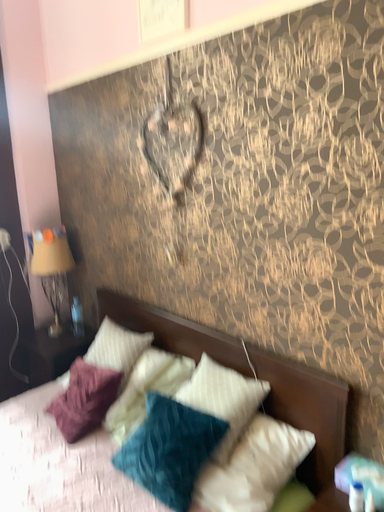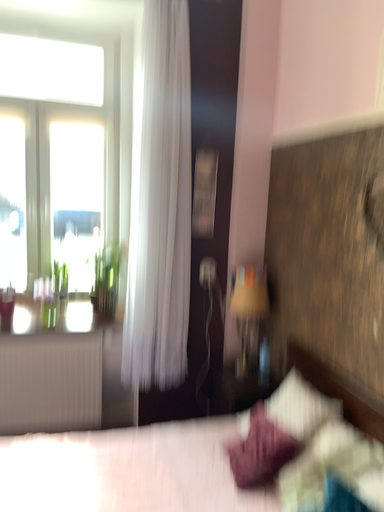
Question: How did the camera likely rotate when shooting the video?

Choices:
 (A) rotated left
 (B) rotated right

Answer: (A)